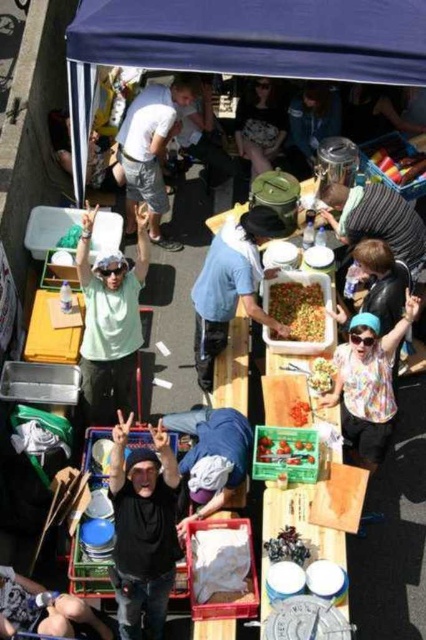
You are a customer at the market and want to grab a translucent plastic cup at upper right to take some drinks. However, you notice the blue fabric canopy at upper center is in the way. Can you easily reach the translucent plastic cups at upper right without moving the canopy?

The blue fabric canopy at upper center is closer to the viewer than the translucent plastic cups at upper right, so the canopy is blocking the path to the cups. You would need to move around the canopy or find another route to reach the translucent plastic cups at upper right.

From the picture: You are a customer at the market and want to buy a green shirt. You see both the black matte shirt at center and the green matte shirt at center on the table. Which one is closer to you?

The black matte shirt at center is below the green matte shirt at center, so the green matte shirt at center is closer to you.